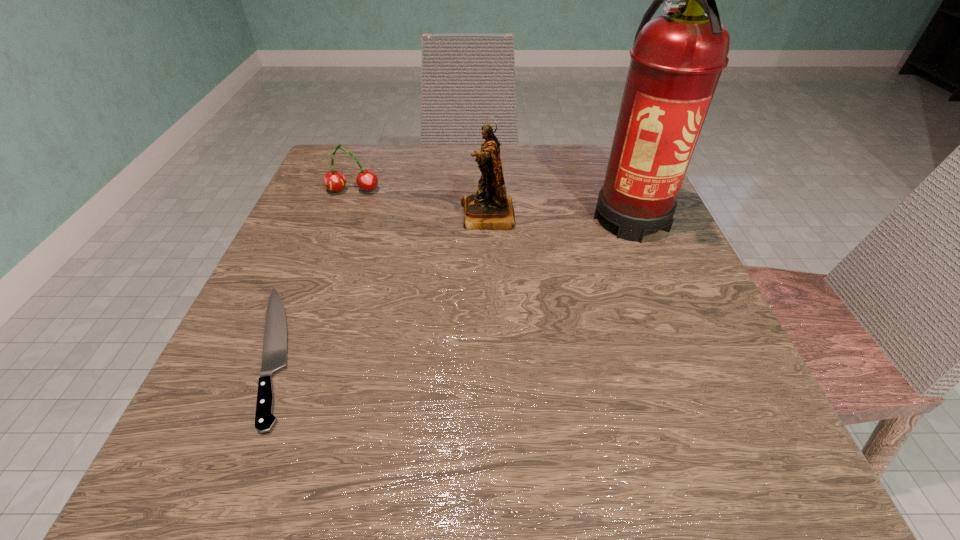
Find the location of a particular element. The width and height of the screenshot is (960, 540). free spot located on the front-facing side of the third shortest object is located at coordinates (305, 215).

The height and width of the screenshot is (540, 960). In order to click on free point located 0.240m with stems pointing upwards on the cherry in this screenshot , I will do `click(322, 276)`.

Image resolution: width=960 pixels, height=540 pixels. Find the location of `vacant space situated 0.240m on the right of the steak knife`. vacant space situated 0.240m on the right of the steak knife is located at coordinates (468, 352).

At what (x,y) coordinates should I click in order to perform the action: click on fire extinguisher at the far edge. Please return your answer as a coordinate pair (x, y). This screenshot has width=960, height=540. Looking at the image, I should click on (677, 58).

You are a GUI agent. You are given a task and a screenshot of the screen. Output one action in this format:
    pyautogui.click(x=<x>, y=<y>)
    Task: Click on the figurine at the far edge
    
    Given the screenshot: What is the action you would take?
    click(491, 208)

Locate an element on the screen. The image size is (960, 540). cherry positioned at the far edge is located at coordinates [x=367, y=180].

Find the location of a particular element. The width and height of the screenshot is (960, 540). object present at the near edge is located at coordinates (274, 356).

This screenshot has height=540, width=960. Find the location of `cherry present at the left edge`. cherry present at the left edge is located at coordinates (367, 180).

At what (x,y) coordinates should I click in order to perform the action: click on steak knife that is at the left edge. Please return your answer as a coordinate pair (x, y). This screenshot has width=960, height=540. Looking at the image, I should click on (274, 356).

Locate an element on the screen. The image size is (960, 540). object at the right edge is located at coordinates (677, 58).